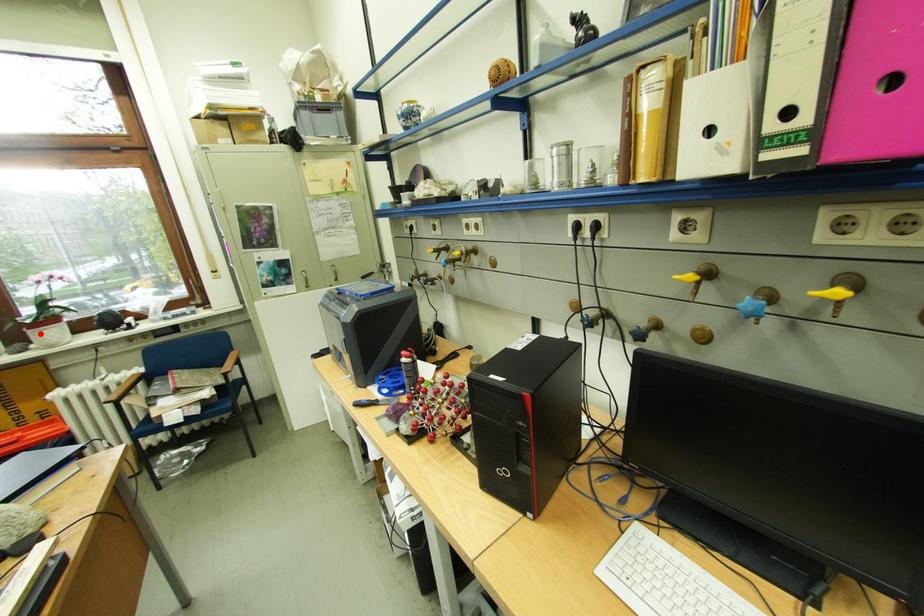
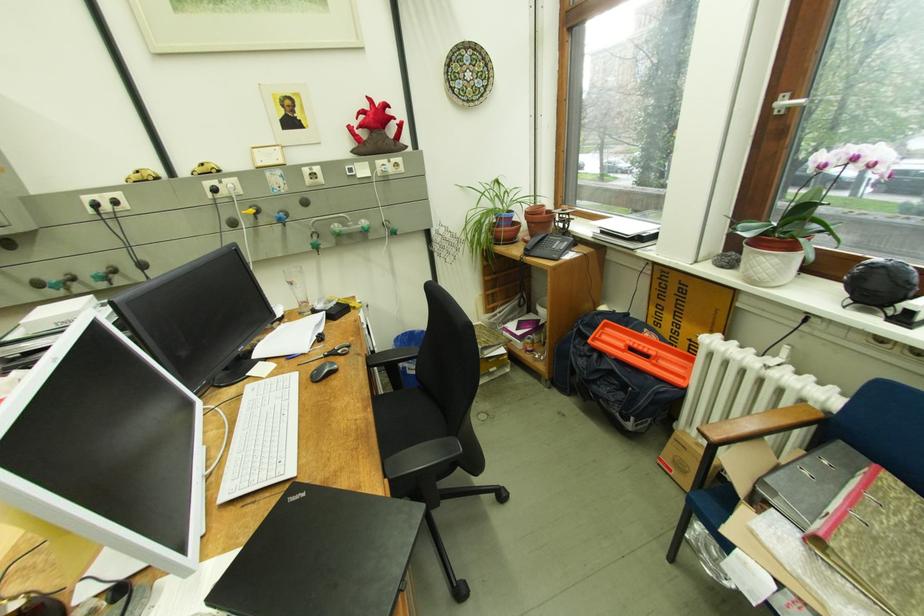
In the second image, find the point that corresponds to the highlighted location in the first image.

(758, 249)